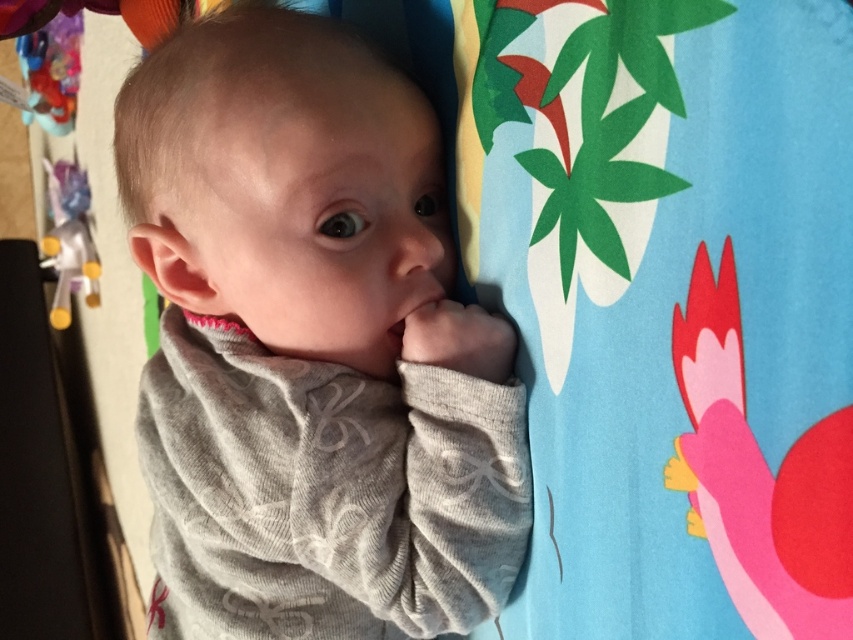
This screenshot has width=853, height=640. What are the coordinates of `gray soft fabric baby at center` in the screenshot? It's located at (311, 348).

Is point (352, 141) farther from viewer compared to point (55, 257)?

That is False.

What do you see at coordinates (311, 348) in the screenshot? I see `gray soft fabric baby at center` at bounding box center [311, 348].

What are the coordinates of `gray soft fabric baby at center` in the screenshot? It's located at (311, 348).

Is gray soft fabric baby at center above plastic toy at upper left?

Actually, gray soft fabric baby at center is below plastic toy at upper left.

Is point (444, 556) positioned in front of point (59, 68)?

Yes.

This screenshot has height=640, width=853. What do you see at coordinates (311, 348) in the screenshot?
I see `gray soft fabric baby at center` at bounding box center [311, 348].

This screenshot has width=853, height=640. What are the coordinates of `gray soft fabric baby at center` in the screenshot? It's located at (311, 348).

Does yellow plastic toy at left have a greater width compared to plastic toy at upper left?

In fact, yellow plastic toy at left might be narrower than plastic toy at upper left.

Which of these two, yellow plastic toy at left or plastic toy at upper left, stands shorter?

Standing shorter between the two is plastic toy at upper left.

Identify the location of yellow plastic toy at left. This screenshot has width=853, height=640. (68, 240).